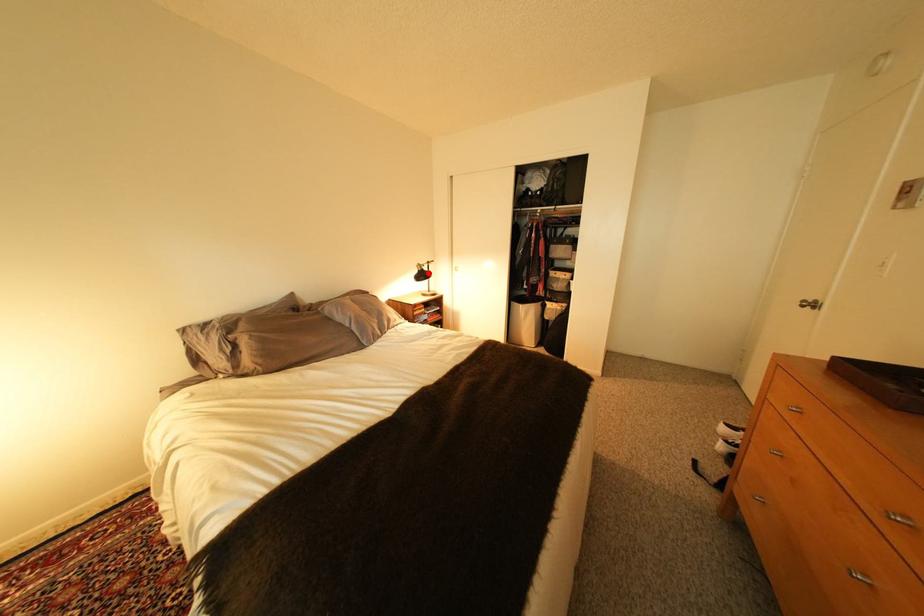
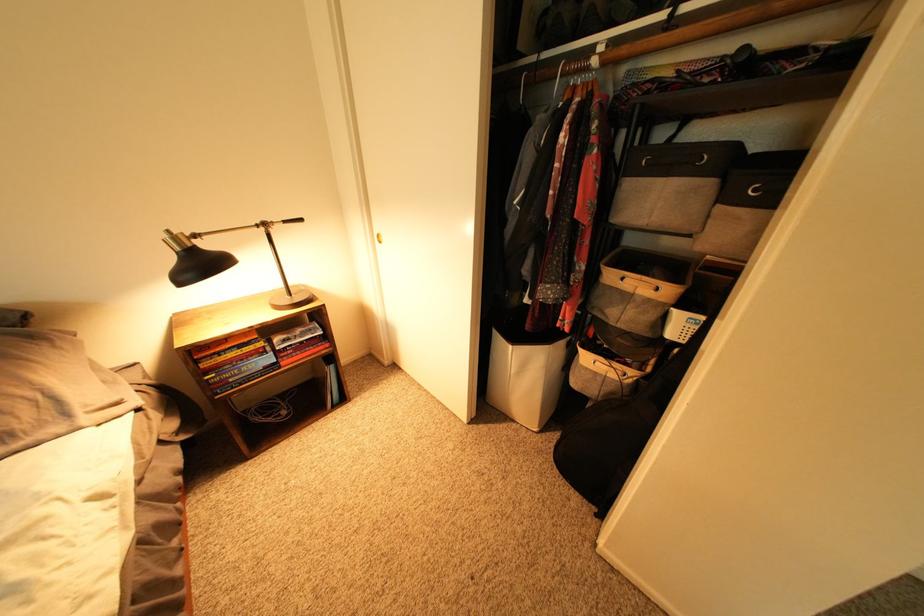
Question: I am providing you with two images of the same scene from different viewpoints. In image1, a red point is highlighted. Considering the same 3D point in image2, which of the following is correct?

Choices:
 (A) It is closer
 (B) It is farther

Answer: (B)